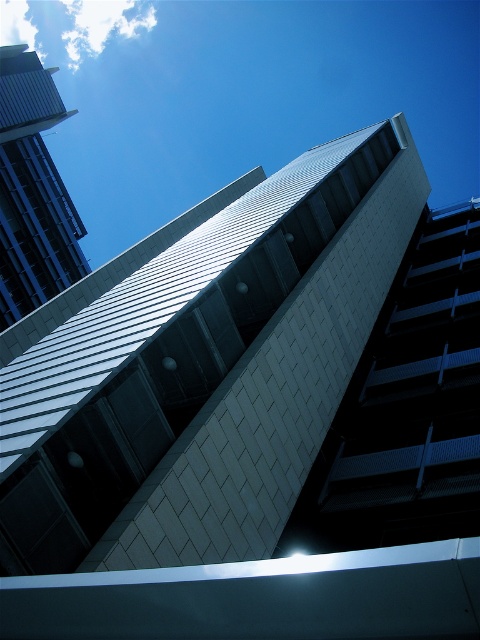
Does point (78, 481) come in front of point (1, 196)?

That is True.

Which is more to the left, metallic silver building at center or smooth glass skyscraper at upper left?

smooth glass skyscraper at upper left is more to the left.

Describe the element at coordinates (205, 371) in the screenshot. I see `metallic silver building at center` at that location.

The width and height of the screenshot is (480, 640). I want to click on metallic silver building at center, so click(205, 371).